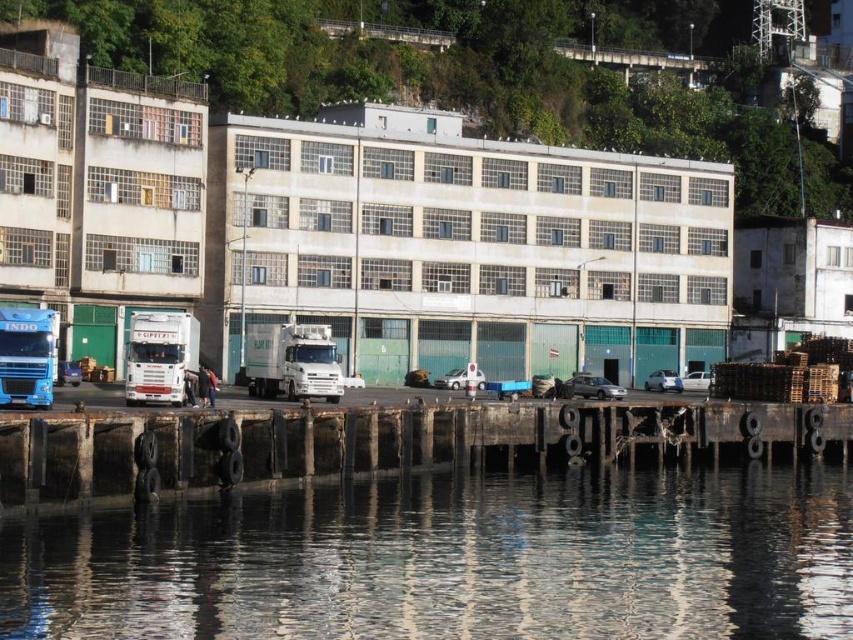
You are a delivery driver who needs to park your white glossy truck at center on the rusty wooden dock at lower center. Is the dock suitable for parking the truck based on its current condition?

The rusty wooden dock at lower center is located below the white glossy truck at center. However, the description mentions the dock has cracked and uneven sections, so it may not be safe or suitable for parking the truck.

You are standing at the point closest to the water on the dock. There are two points marked on the dock. One is at coordinate point(x=404, y=436) and the other at point(x=164, y=320). Which point is closer to you?

Point(x=164, y=320) is closer to you because it is in front of point(x=404, y=436).

You are a delivery driver who has just arrived at the industrial waterfront. Your truck, the white glossy truck at center, is parked on the dock. You need to unload some cargo into the transparent water at lower center. Is the truck positioned in a way that allows you to directly access the water from its current location?

The transparent water at lower center is located below the white glossy truck at center, so yes, the truck is positioned directly above the water, allowing for direct access to unload cargo into the transparent water at lower center.